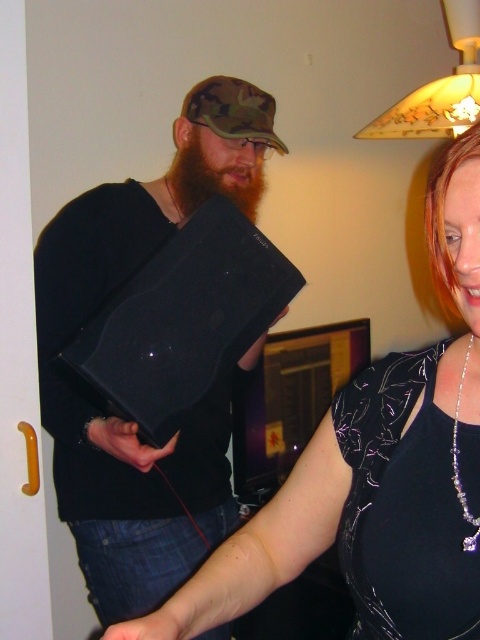
Is blonde shiny hair at upper right to the left of silver metallic necklace at upper right from the viewer's perspective?

No, blonde shiny hair at upper right is not to the left of silver metallic necklace at upper right.

Between blonde shiny hair at upper right and silver metallic necklace at upper right, which one has less height?

Standing shorter between the two is silver metallic necklace at upper right.

Is point (459, 317) in front of point (466, 502)?

No, it is behind (466, 502).

Locate an element on the screen. blonde shiny hair at upper right is located at coordinates [443, 216].

Is matte black laptop at left to the left of silver metallic necklace at upper right from the viewer's perspective?

Correct, you'll find matte black laptop at left to the left of silver metallic necklace at upper right.

Between matte black laptop at left and silver metallic necklace at upper right, which one is positioned lower?

Positioned lower is silver metallic necklace at upper right.

The width and height of the screenshot is (480, 640). Find the location of `matte black laptop at left`. matte black laptop at left is located at coordinates (117, 417).

Can you confirm if shiny black dress at center is positioned to the right of matte black laptop at left?

Correct, you'll find shiny black dress at center to the right of matte black laptop at left.

Is point (478, 225) less distant than point (101, 532)?

Yes, point (478, 225) is closer to viewer.

Where is `shiny black dress at center`? The height and width of the screenshot is (640, 480). shiny black dress at center is located at coordinates (374, 472).